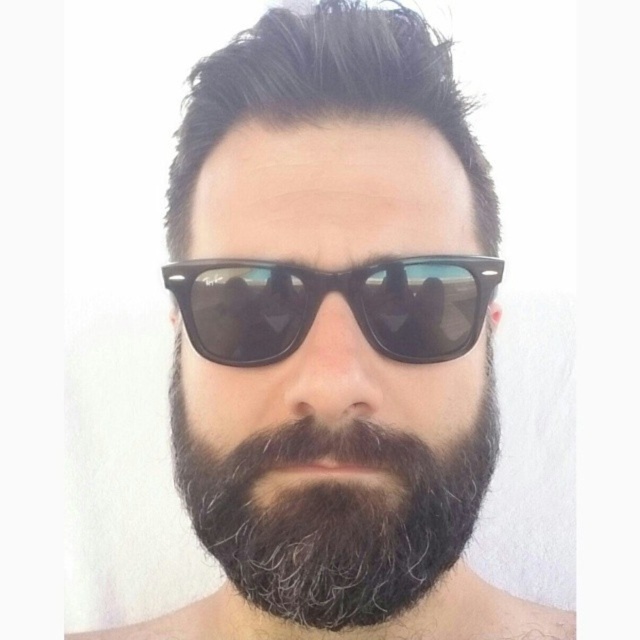
Can you confirm if dark brown hair at center is positioned to the left of black plastic sunglasses at center?

Yes, dark brown hair at center is to the left of black plastic sunglasses at center.

Is point (268, 51) farther from camera compared to point (429, 284)?

Yes, point (268, 51) is behind point (429, 284).

Between point (474, 176) and point (243, 336), which one is positioned in front?

Point (243, 336) is in front.

Identify the location of dark brown hair at center. The width and height of the screenshot is (640, 640). (324, 92).

Can you confirm if dark brown textured beard at center is smaller than black plastic sunglasses at center?

No, dark brown textured beard at center is not smaller than black plastic sunglasses at center.

Image resolution: width=640 pixels, height=640 pixels. Find the location of `dark brown textured beard at center`. dark brown textured beard at center is located at coordinates (333, 513).

Who is positioned more to the left, dark brown textured beard at center or dark brown hair at center?

dark brown hair at center

Which of these two, dark brown textured beard at center or dark brown hair at center, stands shorter?

Standing shorter between the two is dark brown textured beard at center.

Describe the element at coordinates (333, 513) in the screenshot. The height and width of the screenshot is (640, 640). I see `dark brown textured beard at center` at that location.

You are a GUI agent. You are given a task and a screenshot of the screen. Output one action in this format:
    pyautogui.click(x=<x>, y=<y>)
    Task: Click on the dark brown textured beard at center
    The image size is (640, 640).
    Given the screenshot: What is the action you would take?
    pyautogui.click(x=333, y=513)